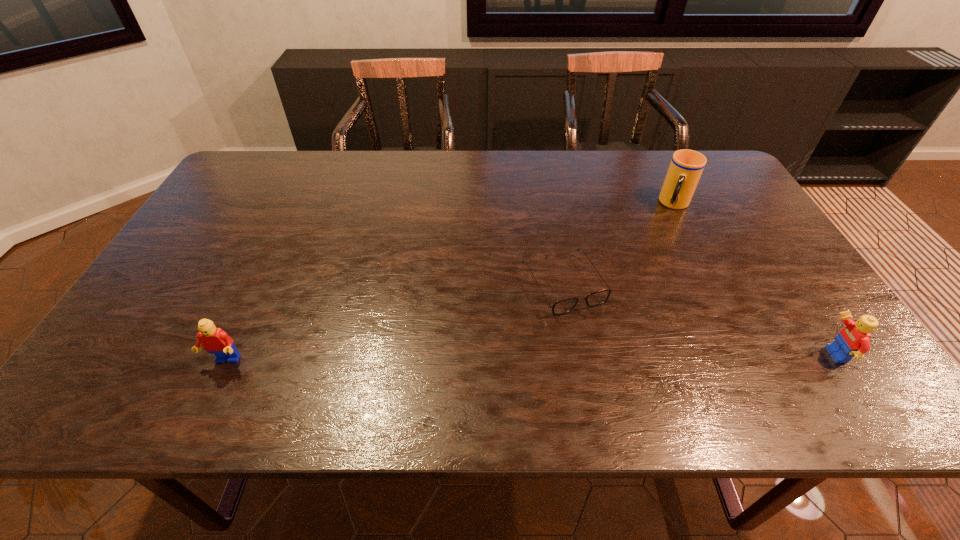
You are a GUI agent. You are given a task and a screenshot of the screen. Output one action in this format:
    pyautogui.click(x=<x>, y=<y>)
    Task: Click on the left Lego
    The height and width of the screenshot is (540, 960).
    Given the screenshot: What is the action you would take?
    pyautogui.click(x=215, y=341)

Where is `the right Lego`? the right Lego is located at coordinates (852, 342).

Locate an element on the screen. This screenshot has height=540, width=960. sunglasses is located at coordinates (596, 298).

Where is `the second object from left to right`? the second object from left to right is located at coordinates (596, 298).

I want to click on cup, so click(686, 167).

I want to click on the tallest object, so click(x=686, y=167).

The width and height of the screenshot is (960, 540). What are the coordinates of `vacant space situated 0.350m on the face of the right Lego` in the screenshot? It's located at (659, 355).

The image size is (960, 540). In order to click on free point located 0.150m on the face of the right Lego in this screenshot , I will do `click(751, 355)`.

Identify the location of vacant space located on the face of the right Lego. The height and width of the screenshot is (540, 960). (797, 355).

You are a GUI agent. You are given a task and a screenshot of the screen. Output one action in this format:
    pyautogui.click(x=<x>, y=<y>)
    Task: Click on the vacant space located 0.130m on the front-facing side of the second object from left to right
    Image resolution: width=960 pixels, height=540 pixels.
    Given the screenshot: What is the action you would take?
    pyautogui.click(x=610, y=361)